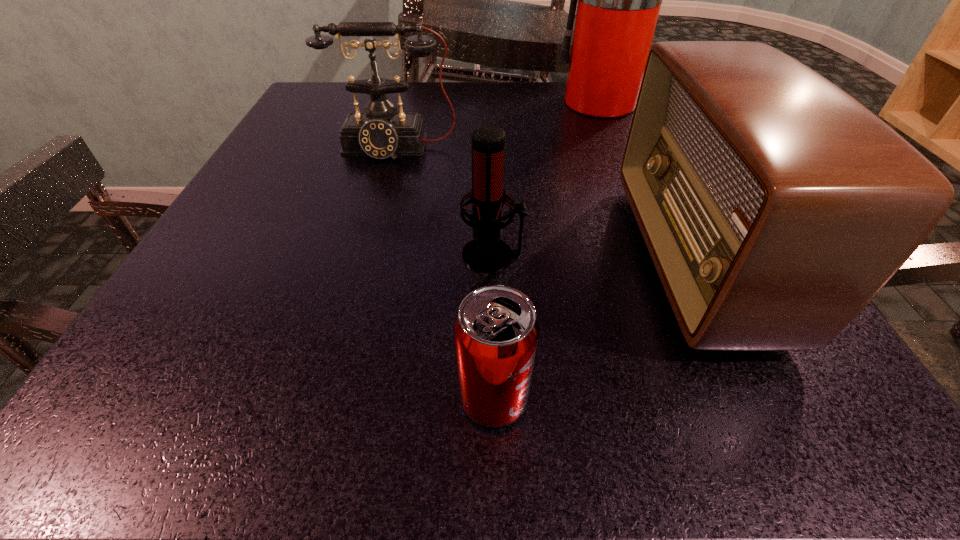
At what (x,y) coordinates should I click in order to perform the action: click on the farthest object. Please return your answer as a coordinate pair (x, y). Looking at the image, I should click on (619, 0).

The width and height of the screenshot is (960, 540). I want to click on the tallest object, so click(619, 0).

Identify the location of radio receiver. This screenshot has width=960, height=540. (775, 206).

Locate an element on the screen. This screenshot has width=960, height=540. telephone is located at coordinates (380, 132).

The height and width of the screenshot is (540, 960). I want to click on the leftmost object, so click(380, 132).

Where is `the fourth tallest object`? The image size is (960, 540). the fourth tallest object is located at coordinates (486, 252).

I want to click on the shortest object, so click(x=496, y=332).

Where is `blank space located 0.160m at the nozzle of the tallest object`? blank space located 0.160m at the nozzle of the tallest object is located at coordinates (479, 103).

Locate an element on the screen. The width and height of the screenshot is (960, 540). free space located 0.270m at the nozzle of the tallest object is located at coordinates (429, 103).

Identify the location of vacant region located 0.390m at the nozzle of the tallest object. (375, 103).